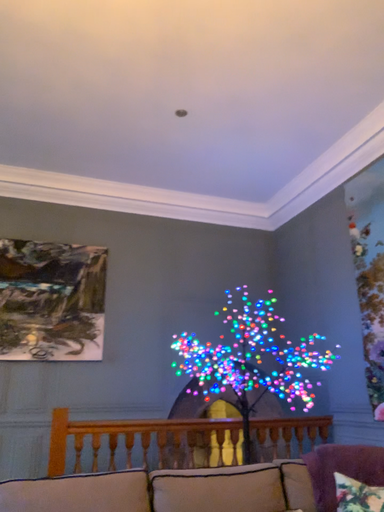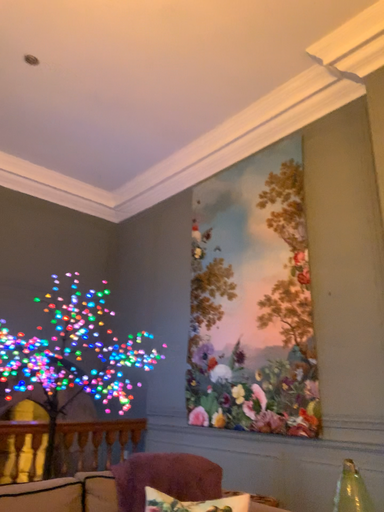
Question: Which way did the camera rotate in the video?

Choices:
 (A) rotated right
 (B) rotated left

Answer: (A)